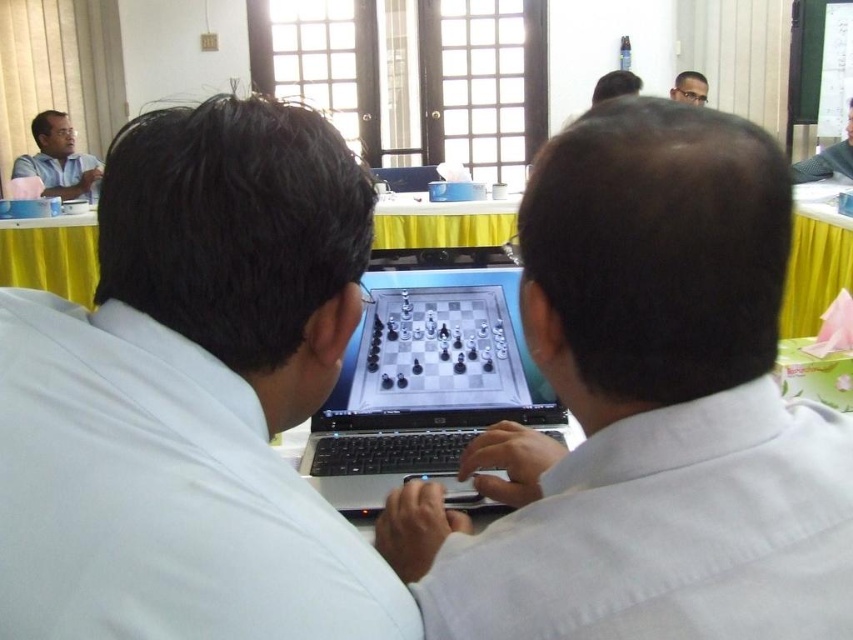
Question: Which object is the closest to the yellow fabric table at center?

Choices:
 (A) metallic chessboard at center
 (B) silver/black keyboard at center
 (C) white matte laptop at center

Answer: (A)

Question: Can you confirm if silver/black keyboard at center is wider than metallic chessboard at center?

Choices:
 (A) yes
 (B) no

Answer: (A)

Question: Which point is closer to the camera?

Choices:
 (A) white matte shirt at center
 (B) white matte laptop at center
 (C) metallic chessboard at center
 (D) matte black hair at upper center

Answer: (B)

Question: Which object appears closest to the camera in this image?

Choices:
 (A) white matte shirt at center
 (B) metallic chessboard at center

Answer: (A)

Question: Is smooth white shirt at upper right to the right of matte black hair at upper center from the viewer's perspective?

Choices:
 (A) no
 (B) yes

Answer: (B)

Question: Is white matte shirt at center above matte blue shirt at upper left?

Choices:
 (A) no
 (B) yes

Answer: (A)